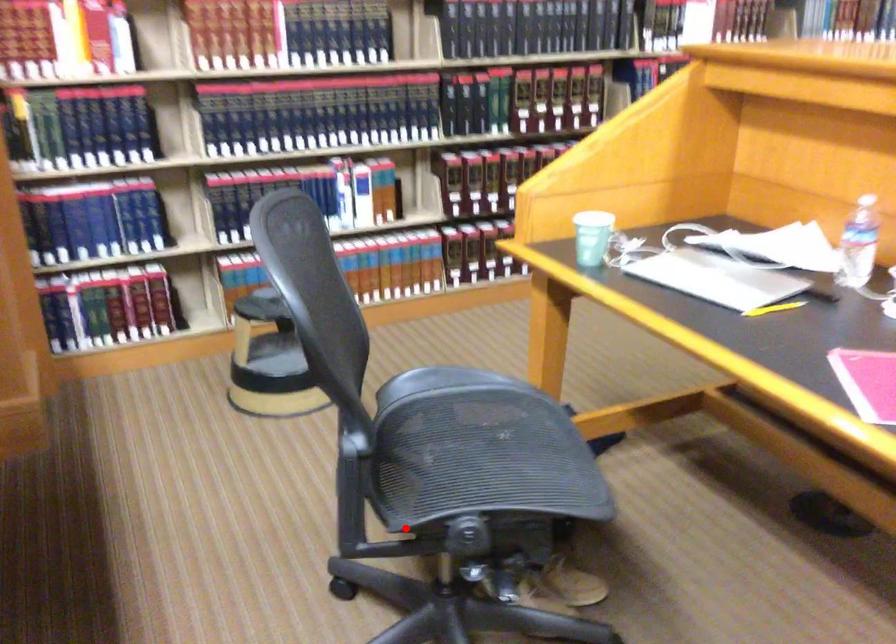
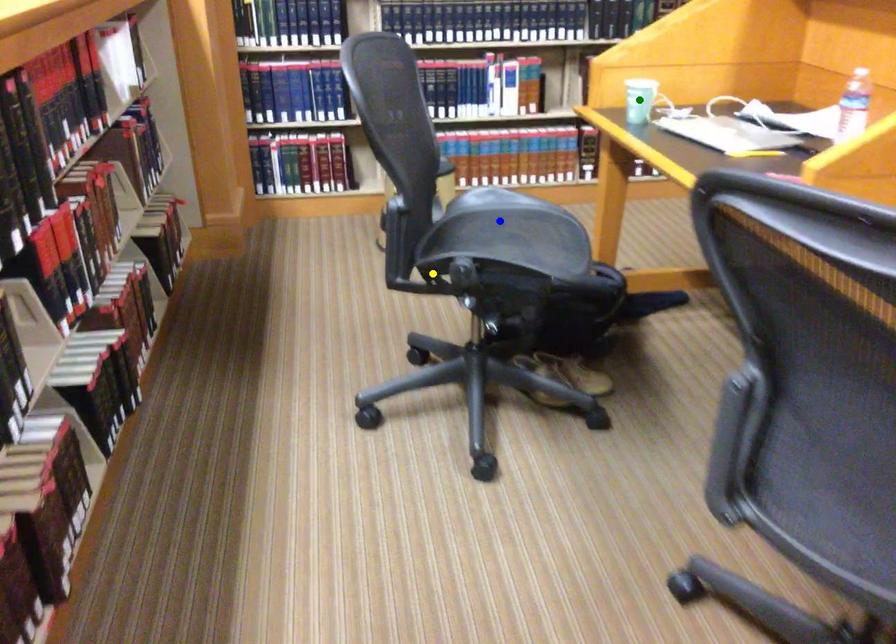
Question: I am providing you with two images of the same scene from different viewpoints. A red point is marked on the first image. You are given multiple points on the second image. Which point in image 2 represents the same 3d spot as the red point in image 1?

Choices:
 (A) blue point
 (B) green point
 (C) yellow point

Answer: (C)